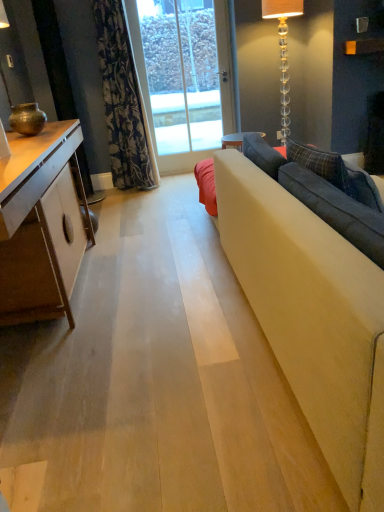
Question: Is floral fabric curtain at upper left not inside clear glass floor lamp at upper right, the first lamp viewed from the right?

Choices:
 (A) yes
 (B) no

Answer: (A)

Question: Is floral fabric curtain at upper left aimed at clear glass floor lamp at upper right, positioned as the second lamp in front-to-back order?

Choices:
 (A) no
 (B) yes

Answer: (A)

Question: Is the position of floral fabric curtain at upper left less distant than that of clear glass floor lamp at upper right, the first lamp viewed from the right?

Choices:
 (A) no
 (B) yes

Answer: (B)

Question: Considering the relative sizes of floral fabric curtain at upper left and clear glass floor lamp at upper right, the first lamp viewed from the right, in the image provided, is floral fabric curtain at upper left wider than clear glass floor lamp at upper right, the first lamp viewed from the right,?

Choices:
 (A) no
 (B) yes

Answer: (A)

Question: Does floral fabric curtain at upper left have a smaller size compared to clear glass floor lamp at upper right, the first lamp viewed from the right?

Choices:
 (A) no
 (B) yes

Answer: (A)

Question: Does floral fabric curtain at upper left have a lesser width compared to clear glass floor lamp at upper right, positioned as the second lamp in front-to-back order?

Choices:
 (A) no
 (B) yes

Answer: (B)

Question: From the image's perspective, is floral fabric curtain at upper left over clear glass door at center?

Choices:
 (A) yes
 (B) no

Answer: (B)

Question: Is floral fabric curtain at upper left positioned in front of clear glass door at center?

Choices:
 (A) no
 (B) yes

Answer: (B)

Question: From a real-world perspective, is floral fabric curtain at upper left beneath clear glass door at center?

Choices:
 (A) no
 (B) yes

Answer: (A)

Question: Could clear glass door at center be considered to be inside floral fabric curtain at upper left?

Choices:
 (A) no
 (B) yes

Answer: (A)

Question: Considering the relative sizes of floral fabric curtain at upper left and clear glass door at center in the image provided, is floral fabric curtain at upper left smaller than clear glass door at center?

Choices:
 (A) no
 (B) yes

Answer: (A)

Question: Is floral fabric curtain at upper left behind clear glass door at center?

Choices:
 (A) no
 (B) yes

Answer: (A)

Question: Considering the relative sizes of clear glass floor lamp at upper right, placed as the 1th lamp when sorted from back to front, and floral fabric curtain at upper left in the image provided, is clear glass floor lamp at upper right, placed as the 1th lamp when sorted from back to front, bigger than floral fabric curtain at upper left?

Choices:
 (A) no
 (B) yes

Answer: (A)